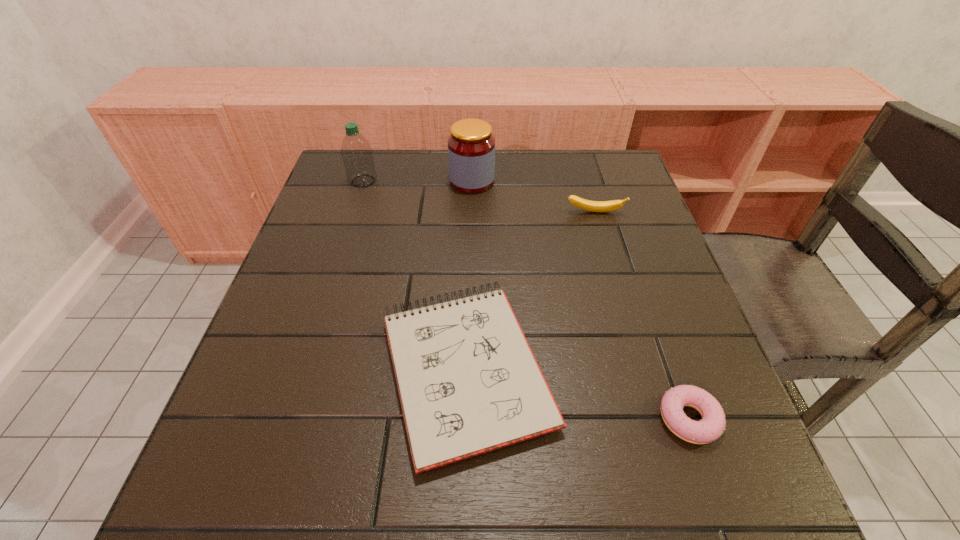
Identify the location of the leftmost object. This screenshot has width=960, height=540. [x=356, y=152].

Find the location of a particular element. Image resolution: width=960 pixels, height=540 pixels. jar is located at coordinates (471, 146).

This screenshot has width=960, height=540. Identify the location of banana. (594, 206).

You are a GUI agent. You are given a task and a screenshot of the screen. Output one action in this format:
    pyautogui.click(x=<x>, y=<y>)
    Task: Click on the third shortest object
    This screenshot has height=540, width=960.
    Given the screenshot: What is the action you would take?
    pyautogui.click(x=594, y=206)

Where is `doughnut`? This screenshot has width=960, height=540. doughnut is located at coordinates (712, 425).

Find the location of a particular element. The width and height of the screenshot is (960, 540). notepad is located at coordinates (468, 382).

Identify the location of vacant space located 0.090m on the right of the leftmost object. This screenshot has height=540, width=960. (411, 181).

Find the location of a particular element. The height and width of the screenshot is (540, 960). vacant space located 0.080m on the left of the jar is located at coordinates (420, 181).

Identify the location of vacant space located at the stem of the third tallest object. The width and height of the screenshot is (960, 540). (627, 322).

The height and width of the screenshot is (540, 960). I want to click on vacant space located on the back of the doughnut, so click(x=650, y=307).